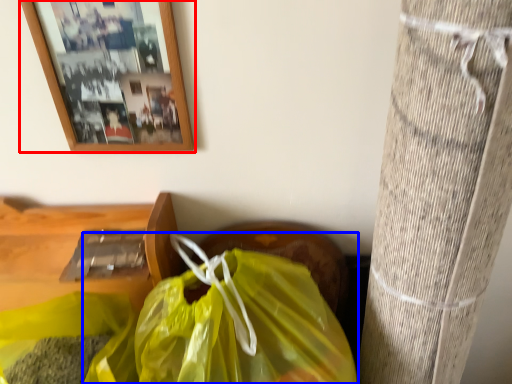
Question: Which point is further to the camera, picture frame (highlighted by a red box) or plastic bag (highlighted by a blue box)?

Choices:
 (A) picture frame
 (B) plastic bag

Answer: (A)